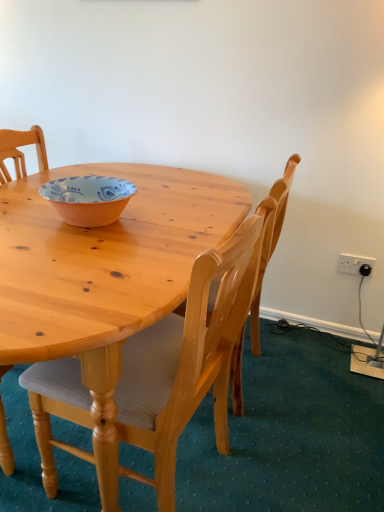
Question: Considering the relative sizes of orange glazed bowl at center and white plastic power outlet at upper right in the image provided, is orange glazed bowl at center taller than white plastic power outlet at upper right?

Choices:
 (A) no
 (B) yes

Answer: (A)

Question: Would you say orange glazed bowl at center is outside white plastic power outlet at upper right?

Choices:
 (A) yes
 (B) no

Answer: (A)

Question: Is white plastic power outlet at upper right completely or partially inside orange glazed bowl at center?

Choices:
 (A) yes
 (B) no

Answer: (B)

Question: Considering the relative sizes of orange glazed bowl at center and white plastic power outlet at upper right in the image provided, is orange glazed bowl at center shorter than white plastic power outlet at upper right?

Choices:
 (A) yes
 (B) no

Answer: (A)

Question: Does orange glazed bowl at center have a greater width compared to white plastic power outlet at upper right?

Choices:
 (A) yes
 (B) no

Answer: (A)

Question: In terms of size, does light wood chair at center, the first chair positioned from the front, appear bigger or smaller than orange glazed bowl at center?

Choices:
 (A) small
 (B) big

Answer: (B)

Question: Is light wood chair at center, the first chair positioned from the front, spatially inside orange glazed bowl at center, or outside of it?

Choices:
 (A) outside
 (B) inside

Answer: (A)

Question: From the image's perspective, is light wood chair at center, the first chair positioned from the front, above or below orange glazed bowl at center?

Choices:
 (A) above
 (B) below

Answer: (B)

Question: Is light wood chair at center, the first chair positioned from the front, taller or shorter than orange glazed bowl at center?

Choices:
 (A) tall
 (B) short

Answer: (A)

Question: Would you say orange glazed bowl at center is inside or outside white plastic power outlet at upper right?

Choices:
 (A) inside
 (B) outside

Answer: (B)

Question: Considering the positions of orange glazed bowl at center and white plastic power outlet at upper right in the image, is orange glazed bowl at center taller or shorter than white plastic power outlet at upper right?

Choices:
 (A) short
 (B) tall

Answer: (A)

Question: Based on their positions, is orange glazed bowl at center located to the left or right of white plastic power outlet at upper right?

Choices:
 (A) left
 (B) right

Answer: (A)

Question: Considering the positions of point (117, 185) and point (370, 257), is point (117, 185) closer or farther from the camera than point (370, 257)?

Choices:
 (A) farther
 (B) closer

Answer: (B)

Question: Is point (359, 262) closer or farther from the camera than point (49, 478)?

Choices:
 (A) farther
 (B) closer

Answer: (A)

Question: Is white plastic power outlet at upper right bigger or smaller than light wood chair at center, the 2th chair from the back?

Choices:
 (A) small
 (B) big

Answer: (A)